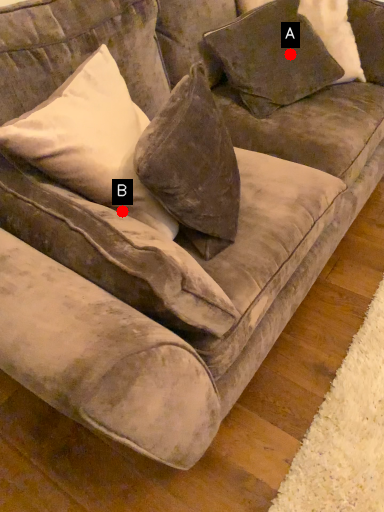
Question: Two points are circled on the image, labeled by A and B beside each circle. Which point is farther from the camera taking this photo?

Choices:
 (A) A is further
 (B) B is further

Answer: (A)